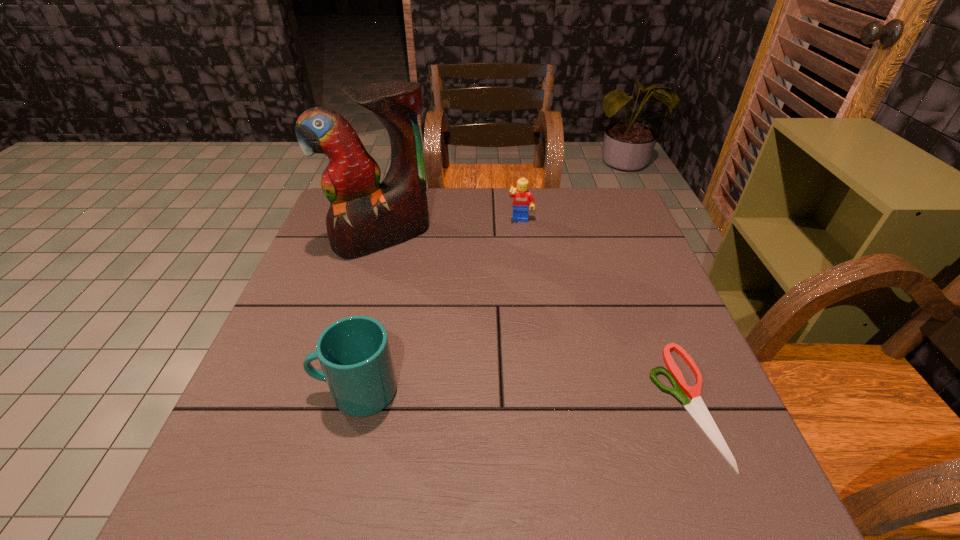
At what (x,y) coordinates should I click in order to perform the action: click on object that is at the far left corner. Please return your answer as a coordinate pair (x, y). Looking at the image, I should click on (365, 216).

This screenshot has width=960, height=540. In order to click on object at the near left corner in this screenshot , I will do `click(354, 353)`.

Image resolution: width=960 pixels, height=540 pixels. I want to click on object positioned at the near right corner, so click(x=696, y=408).

Find the location of a particular element. vacant region at the far edge is located at coordinates (559, 193).

Identify the location of free space at the near edge. The width and height of the screenshot is (960, 540). (348, 430).

In the image, there is a desktop. Identify the location of vacant space at the right edge. This screenshot has height=540, width=960. (627, 293).

In the image, there is a desktop. Identify the location of free space at the far right corner. (590, 222).

At what (x,y) coordinates should I click in order to perform the action: click on free point at the near right corner. Please return your answer as a coordinate pair (x, y). The image size is (960, 540). Looking at the image, I should click on (659, 437).

You are a GUI agent. You are given a task and a screenshot of the screen. Output one action in this format:
    pyautogui.click(x=<x>, y=<y>)
    Task: Click on the vacant area between the shortest object and the third object from left to right
    The width and height of the screenshot is (960, 540).
    Given the screenshot: What is the action you would take?
    pyautogui.click(x=603, y=312)

Image resolution: width=960 pixels, height=540 pixels. Find the location of `empty space between the tallest object and the rightmost object`. empty space between the tallest object and the rightmost object is located at coordinates (534, 320).